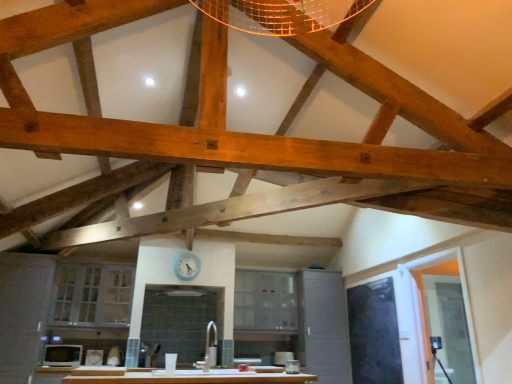
Describe the element at coordinates (324, 326) in the screenshot. This screenshot has width=512, height=384. I see `matte gray cabinet at center, arranged as the 1th cabinetry when viewed from the right` at that location.

Image resolution: width=512 pixels, height=384 pixels. What do you see at coordinates (187, 266) in the screenshot?
I see `blue glossy clock at upper center` at bounding box center [187, 266].

At what (x,y) coordinates should I click in order to perform the action: click on blue glossy clock at upper center. Please return your answer as a coordinate pair (x, y). The image size is (512, 384). Looking at the image, I should click on (187, 266).

Image resolution: width=512 pixels, height=384 pixels. Describe the element at coordinates (465, 299) in the screenshot. I see `transparent glass door at right` at that location.

Identify the location of matte gray cabinet at center, which is the 2th cabinetry in right-to-left order. The height and width of the screenshot is (384, 512). (265, 301).

Are blue glossy clock at upper center and matte white microwave at lower left beside each other?

No, blue glossy clock at upper center is not touching matte white microwave at lower left.

Between blue glossy clock at upper center and matte white microwave at lower left, which one is positioned in front?

matte white microwave at lower left is more forward.

Between blue glossy clock at upper center and matte white microwave at lower left, which one has smaller width?

Thinner between the two is blue glossy clock at upper center.

Which is in front, point (177, 264) or point (80, 356)?

The point (80, 356) is more forward.

Is transparent glass door at right positioned far away from white glass cabinet at lower left, the first cabinetry positioned from the left?

transparent glass door at right is far away from white glass cabinet at lower left, the first cabinetry positioned from the left.

From a real-world perspective, is transparent glass door at right located higher than white glass cabinet at lower left, the first cabinetry positioned from the left?

No, from a real-world perspective, transparent glass door at right is not on top of white glass cabinet at lower left, the first cabinetry positioned from the left.

From the transparent glass door at right, count 1st cabinetrys backward and point to it. Please provide its 2D coordinates.

[(92, 294)]

Consider the image. Is transparent glass door at right to the left or to the right of white glass cabinet at lower left, positioned as the third cabinetry in right-to-left order, in the image?

From the image, it's evident that transparent glass door at right is to the right of white glass cabinet at lower left, positioned as the third cabinetry in right-to-left order.

Which is correct: white glass cabinet at lower left, positioned as the third cabinetry in right-to-left order, is inside matte gray cabinet at center, which is the second cabinetry from left to right, or outside of it?

white glass cabinet at lower left, positioned as the third cabinetry in right-to-left order, is located beyond the bounds of matte gray cabinet at center, which is the second cabinetry from left to right.

How far apart are white glass cabinet at lower left, the first cabinetry positioned from the left, and matte gray cabinet at center, which is the 2th cabinetry in right-to-left order?

The distance of white glass cabinet at lower left, the first cabinetry positioned from the left, from matte gray cabinet at center, which is the 2th cabinetry in right-to-left order, is 1.94 meters.

At what (x,y) coordinates should I click in order to perform the action: click on the 1st cabinetry located beneath the matte gray cabinet at center, which is the 2th cabinetry in right-to-left order (from a real-world perspective). Please return your answer as a coordinate pair (x, y). The width and height of the screenshot is (512, 384). Looking at the image, I should click on (92, 294).

Which object is wider, white glass cabinet at lower left, positioned as the third cabinetry in right-to-left order, or matte gray cabinet at center, which is the 2th cabinetry in right-to-left order?

With larger width is white glass cabinet at lower left, positioned as the third cabinetry in right-to-left order.

Considering the relative sizes of blue glossy clock at upper center and matte gray cabinet at center, which is the 2th cabinetry in right-to-left order, in the image provided, is blue glossy clock at upper center shorter than matte gray cabinet at center, which is the 2th cabinetry in right-to-left order,?

Indeed, blue glossy clock at upper center has a lesser height compared to matte gray cabinet at center, which is the 2th cabinetry in right-to-left order.

Is blue glossy clock at upper center situated inside matte gray cabinet at center, which is the second cabinetry from left to right, or outside?

blue glossy clock at upper center is not inside matte gray cabinet at center, which is the second cabinetry from left to right, it's outside.

Would you say blue glossy clock at upper center is a long distance from matte gray cabinet at center, which is the second cabinetry from left to right?

Yes, blue glossy clock at upper center is far from matte gray cabinet at center, which is the second cabinetry from left to right.

In order to click on glass door that appears above the white glossy sink at center (from a real-world perspective) in this screenshot , I will do `click(465, 299)`.

How much distance is there between white glossy sink at center and transparent glass door at right?

white glossy sink at center and transparent glass door at right are 2.64 meters apart from each other.

Considering the relative positions of white glossy sink at center and transparent glass door at right in the image provided, is white glossy sink at center to the right of transparent glass door at right from the viewer's perspective?

No.

In the scene shown: Is white glossy sink at center located outside transparent glass door at right?

That's correct, white glossy sink at center is outside of transparent glass door at right.

Can you confirm if matte gray cabinet at center, arranged as the 1th cabinetry when viewed from the right, is taller than matte gray cabinet at center, which is the 2th cabinetry in right-to-left order?

Yes.

Can we say matte gray cabinet at center, arranged as the 1th cabinetry when viewed from the right, lies outside matte gray cabinet at center, which is the 2th cabinetry in right-to-left order?

Yes, matte gray cabinet at center, arranged as the 1th cabinetry when viewed from the right, is outside of matte gray cabinet at center, which is the 2th cabinetry in right-to-left order.

Is matte gray cabinet at center, arranged as the 1th cabinetry when viewed from the right, next to matte gray cabinet at center, which is the second cabinetry from left to right, and touching it?

No, matte gray cabinet at center, arranged as the 1th cabinetry when viewed from the right, is not beside matte gray cabinet at center, which is the second cabinetry from left to right.

Considering the positions of objects matte gray cabinet at center, which is counted as the 3th cabinetry, starting from the left, and matte gray cabinet at center, which is the 2th cabinetry in right-to-left order, in the image provided, who is in front, matte gray cabinet at center, which is counted as the 3th cabinetry, starting from the left, or matte gray cabinet at center, which is the 2th cabinetry in right-to-left order,?

Positioned in front is matte gray cabinet at center, which is counted as the 3th cabinetry, starting from the left.

Is matte white microwave at lower left turned away from white glossy sink at center?

That's not correct — matte white microwave at lower left is not looking away from white glossy sink at center.

Consider the image. Is matte white microwave at lower left smaller than white glossy sink at center?

Indeed, matte white microwave at lower left has a smaller size compared to white glossy sink at center.

From the image's perspective, which one is positioned higher, matte white microwave at lower left or white glossy sink at center?

white glossy sink at center.

How many degrees apart are the facing directions of matte white microwave at lower left and white glossy sink at center?

179 degrees.

Identify the location of appliance below the blue glossy clock at upper center (from a real-world perspective). The image size is (512, 384). (62, 355).

The height and width of the screenshot is (384, 512). In order to click on the 2nd cabinetry directly above the transparent glass door at right (from a real-world perspective) in this screenshot , I will do `click(92, 294)`.

Considering their positions, is white glossy sink at center positioned closer to white glass cabinet at lower left, the first cabinetry positioned from the left, than blue glossy clock at upper center?

blue glossy clock at upper center lies closer to white glass cabinet at lower left, the first cabinetry positioned from the left, than the other object.

From the image, which object appears to be nearer to matte gray cabinet at center, which is the second cabinetry from left to right, white glass cabinet at lower left, positioned as the third cabinetry in right-to-left order, or matte gray cabinet at center, arranged as the 1th cabinetry when viewed from the right?

matte gray cabinet at center, arranged as the 1th cabinetry when viewed from the right.

Which object lies further to the anchor point matte white microwave at lower left, white glossy sink at center or matte gray cabinet at center, which is the second cabinetry from left to right?

matte gray cabinet at center, which is the second cabinetry from left to right, lies further to matte white microwave at lower left than the other object.

Considering their positions, is matte gray cabinet at center, which is counted as the 3th cabinetry, starting from the left, positioned further to matte white microwave at lower left than matte gray cabinet at center, which is the second cabinetry from left to right?

Based on the image, matte gray cabinet at center, which is counted as the 3th cabinetry, starting from the left, appears to be further to matte white microwave at lower left.

Looking at the image, which one is located further to matte gray cabinet at center, which is the 2th cabinetry in right-to-left order, matte white microwave at lower left or matte gray cabinet at center, arranged as the 1th cabinetry when viewed from the right?

matte white microwave at lower left.

When comparing their distances from matte gray cabinet at center, which is counted as the 3th cabinetry, starting from the left, does blue glossy clock at upper center or matte white microwave at lower left seem further?

Among the two, matte white microwave at lower left is located further to matte gray cabinet at center, which is counted as the 3th cabinetry, starting from the left.

Based on their spatial positions, is matte gray cabinet at center, which is counted as the 3th cabinetry, starting from the left, or matte gray cabinet at center, which is the 2th cabinetry in right-to-left order, closer to transparent glass door at right?

matte gray cabinet at center, which is counted as the 3th cabinetry, starting from the left, is closer to transparent glass door at right.

Based on the photo, based on their spatial positions, is matte gray cabinet at center, arranged as the 1th cabinetry when viewed from the right, or transparent glass door at right closer to white glass cabinet at lower left, positioned as the third cabinetry in right-to-left order?

Based on the image, matte gray cabinet at center, arranged as the 1th cabinetry when viewed from the right, appears to be nearer to white glass cabinet at lower left, positioned as the third cabinetry in right-to-left order.

The height and width of the screenshot is (384, 512). Identify the location of clock situated between matte white microwave at lower left and transparent glass door at right from left to right. (187, 266).

The height and width of the screenshot is (384, 512). Identify the location of clock located between white glass cabinet at lower left, positioned as the third cabinetry in right-to-left order, and matte gray cabinet at center, which is the second cabinetry from left to right, in the left-right direction. (187, 266).

This screenshot has height=384, width=512. Identify the location of clock between matte white microwave at lower left and matte gray cabinet at center, which is the 2th cabinetry in right-to-left order, in the horizontal direction. (187, 266).

At what (x,y) coordinates should I click in order to perform the action: click on sink between white glass cabinet at lower left, the first cabinetry positioned from the left, and transparent glass door at right. Please return your answer as a coordinate pair (x, y). The width and height of the screenshot is (512, 384). Looking at the image, I should click on (215, 354).